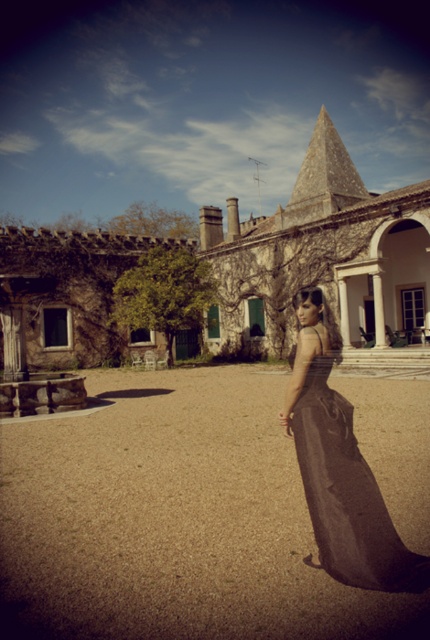
Who is shorter, brown gravel at center or matte black dress at center?

With less height is brown gravel at center.

Does point (181, 424) come farther from viewer compared to point (307, 410)?

That is True.

Locate an element on the screen. This screenshot has width=430, height=640. brown gravel at center is located at coordinates (172, 518).